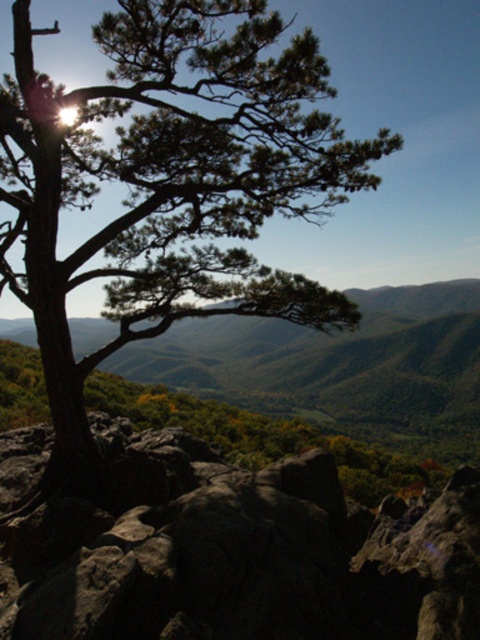
Based on the coordinates provided, what is the object located at point (169, 180) in the scene?

The point (169, 180) indicates a green needle like tree at center.